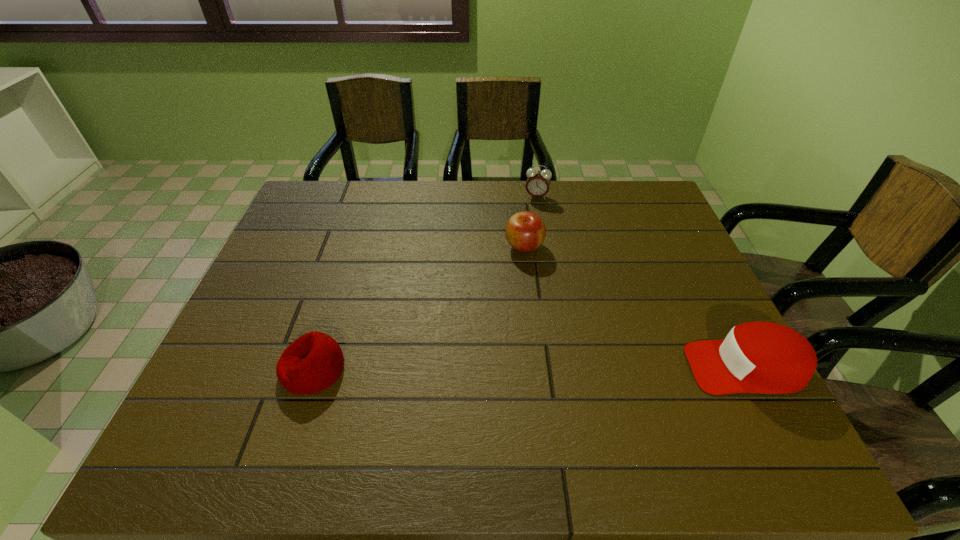
The width and height of the screenshot is (960, 540). What are the coordinates of `free spot between the farthest object and the beanbag` in the screenshot? It's located at (424, 283).

The width and height of the screenshot is (960, 540). In order to click on empty location between the shortest object and the farthest object in this screenshot , I will do `click(424, 283)`.

I want to click on free space between the beanbag and the baseball cap, so click(x=529, y=368).

The height and width of the screenshot is (540, 960). I want to click on vacant space that's between the shortest object and the farthest object, so click(424, 283).

Identify the location of vacant point located between the shortest object and the rightmost object. The width and height of the screenshot is (960, 540). (529, 368).

Locate which object ranks second in proximity to the second farthest object. Please provide its 2D coordinates. Your answer should be formatted as a tuple, i.e. [(x, y)], where the tuple contains the x and y coordinates of a point satisfying the conditions above.

[(755, 357)]

The width and height of the screenshot is (960, 540). What are the coordinates of `object that is the second closest to the beanbag` in the screenshot? It's located at (538, 182).

Find the location of a particular element. The image size is (960, 540). vacant space that satisfies the following two spatial constraints: 1. on the front side of the alarm clock; 2. on the front-facing side of the rightmost object is located at coordinates (564, 367).

Locate an element on the screen. Image resolution: width=960 pixels, height=540 pixels. free space that satisfies the following two spatial constraints: 1. on the front side of the farthest object; 2. on the front-facing side of the baseball cap is located at coordinates (564, 367).